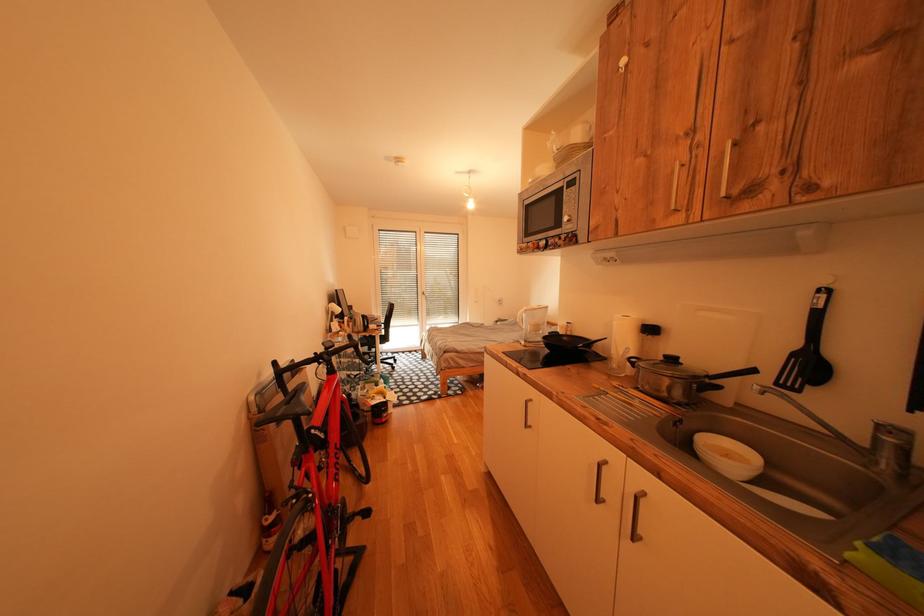
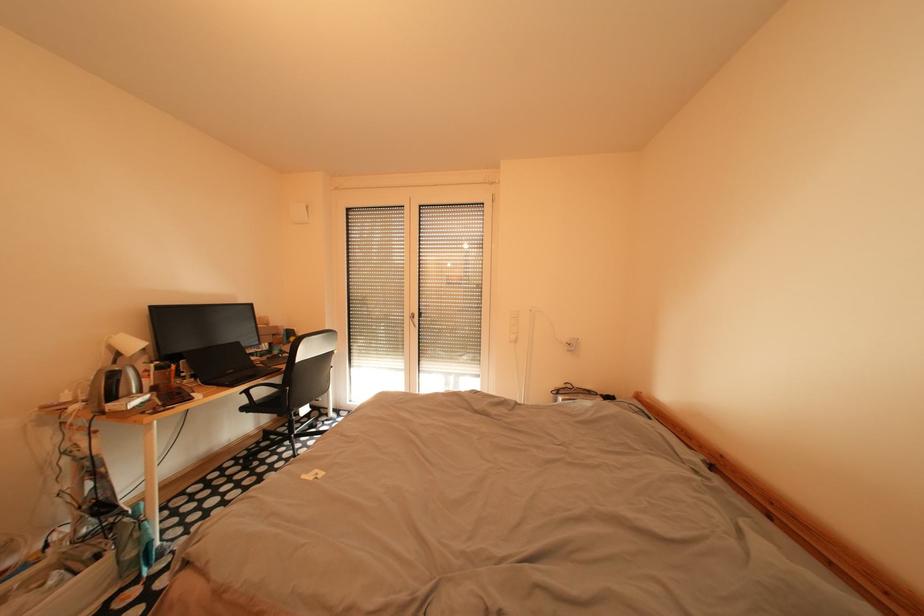
Question: What movement of the cameraman would produce the second image?

Choices:
 (A) Left
 (B) Right
 (C) Forward
 (D) Backward

Answer: (C)